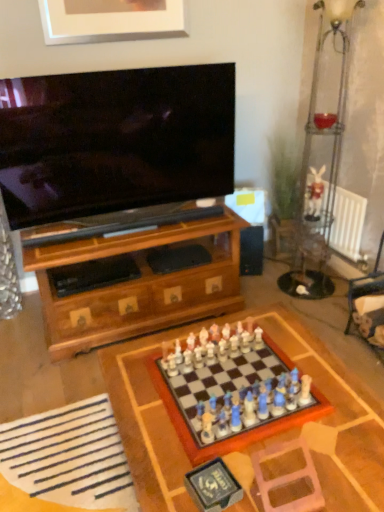
Image resolution: width=384 pixels, height=512 pixels. Find the location of `vacant area located to the right-hand side of pink plastic swivel chair at lower right, which ranks as the first swivel chair in bottom-to-top order`. vacant area located to the right-hand side of pink plastic swivel chair at lower right, which ranks as the first swivel chair in bottom-to-top order is located at coordinates (345, 476).